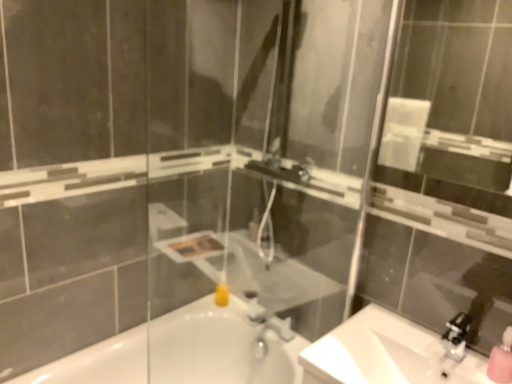
Question: Is white glossy sink at lower right further to the viewer compared to clear glass mirror at upper center?

Choices:
 (A) yes
 (B) no

Answer: (A)

Question: From the image's perspective, is white glossy sink at lower right above clear glass mirror at upper center?

Choices:
 (A) no
 (B) yes

Answer: (A)

Question: Is white glossy sink at lower right shorter than clear glass mirror at upper center?

Choices:
 (A) no
 (B) yes

Answer: (B)

Question: Is white glossy sink at lower right at the left side of clear glass mirror at upper center?

Choices:
 (A) yes
 (B) no

Answer: (A)

Question: Is white glossy sink at lower right taller than clear glass mirror at upper center?

Choices:
 (A) no
 (B) yes

Answer: (A)

Question: From a real-world perspective, is satin nickel faucet at lower right above or below clear glass mirror at upper center?

Choices:
 (A) above
 (B) below

Answer: (B)

Question: Considering the relative positions of satin nickel faucet at lower right and clear glass mirror at upper center in the image provided, is satin nickel faucet at lower right to the left or to the right of clear glass mirror at upper center?

Choices:
 (A) left
 (B) right

Answer: (B)

Question: Is satin nickel faucet at lower right in front of or behind clear glass mirror at upper center in the image?

Choices:
 (A) front
 (B) behind

Answer: (B)

Question: Is satin nickel faucet at lower right taller or shorter than clear glass mirror at upper center?

Choices:
 (A) short
 (B) tall

Answer: (A)

Question: In the image, is white glossy sink at lower right positioned in front of or behind clear glass mirror at upper center?

Choices:
 (A) behind
 (B) front

Answer: (A)

Question: Considering the positions of point (438, 360) and point (421, 97), is point (438, 360) closer or farther from the camera than point (421, 97)?

Choices:
 (A) farther
 (B) closer

Answer: (B)

Question: From the image's perspective, is white glossy sink at lower right positioned above or below clear glass mirror at upper center?

Choices:
 (A) below
 (B) above

Answer: (A)

Question: Considering the positions of white glossy sink at lower right and clear glass mirror at upper center in the image, is white glossy sink at lower right taller or shorter than clear glass mirror at upper center?

Choices:
 (A) tall
 (B) short

Answer: (B)

Question: Considering the positions of white glossy sink at lower right and matte silver faucet at center in the image, is white glossy sink at lower right wider or thinner than matte silver faucet at center?

Choices:
 (A) wide
 (B) thin

Answer: (A)

Question: From a real-world perspective, is white glossy sink at lower right positioned above or below matte silver faucet at center?

Choices:
 (A) below
 (B) above

Answer: (B)